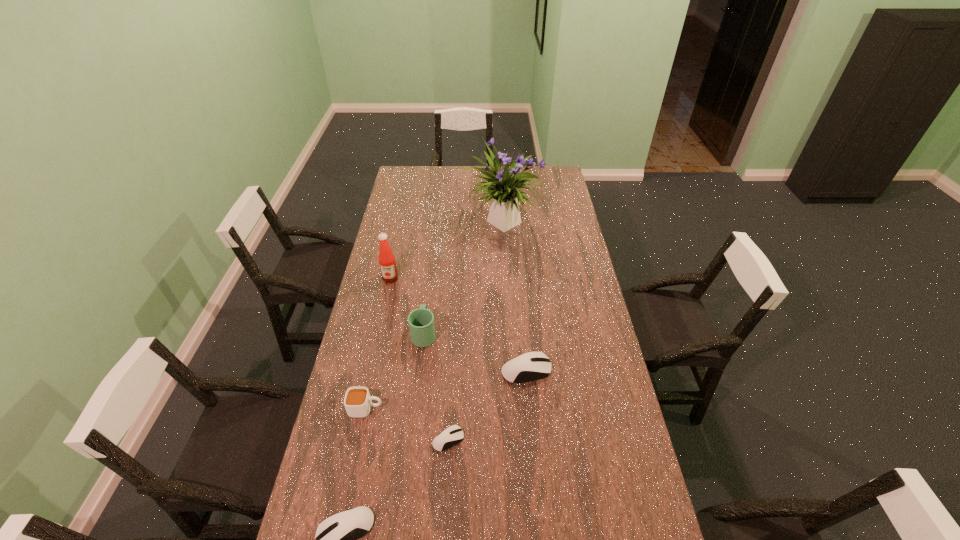
Identify the location of the third nearest object. (357, 401).

Where is `the fourth shortest object`? The width and height of the screenshot is (960, 540). the fourth shortest object is located at coordinates (357, 401).

Locate an element on the screen. free region located on the front of the sixth farthest object is located at coordinates (444, 513).

Find the location of `vacant space located 0.130m on the front of the fourth farthest object`. vacant space located 0.130m on the front of the fourth farthest object is located at coordinates [x=531, y=420].

The height and width of the screenshot is (540, 960). Identify the location of free space located 0.290m on the side of the mug with the handle. (432, 269).

I want to click on vacant space located on the side of the mug with the handle, so click(428, 303).

Locate an element on the screen. free space located on the side of the mug with the handle is located at coordinates (432, 264).

Where is `vacant space located 0.200m on the front-facing side of the sixth shortest object`? The width and height of the screenshot is (960, 540). vacant space located 0.200m on the front-facing side of the sixth shortest object is located at coordinates (381, 320).

Where is `vacant space located 0.110m on the left of the flower arrangement`? This screenshot has width=960, height=540. vacant space located 0.110m on the left of the flower arrangement is located at coordinates (435, 222).

Locate an element on the screen. This screenshot has height=540, width=960. free space located 0.350m on the side with the handle of the cup is located at coordinates (492, 409).